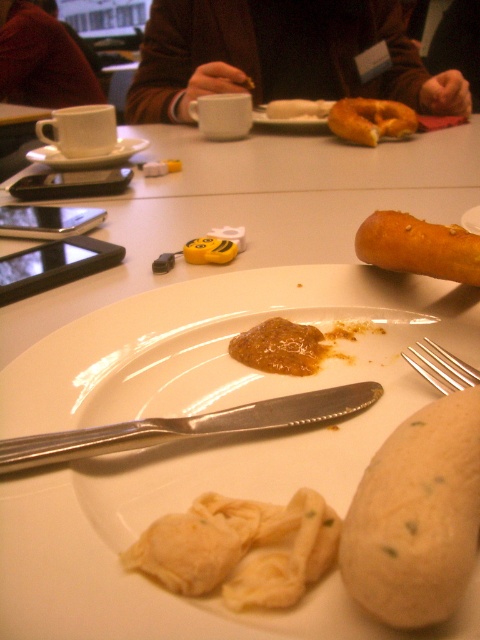
Question: Does smooth beige bread at lower right have a lesser width compared to soft yellow pasta at plate center?

Choices:
 (A) yes
 (B) no

Answer: (A)

Question: Does soft yellow pasta at plate center appear on the right side of brown glossy jam at center?

Choices:
 (A) no
 (B) yes

Answer: (A)

Question: Among these points, which one is nearest to the camera?

Choices:
 (A) (19, 19)
 (B) (280, 348)
 (C) (408, 595)
 (D) (333, 1)

Answer: (C)

Question: Which of the following is the farthest from the observer?

Choices:
 (A) smooth white bread at center
 (B) golden crispy bread at right
 (C) dark brown leather jacket at upper left
 (D) smooth beige bread at lower right

Answer: (C)

Question: Is smooth beige bread at lower right to the right of silver metallic knife at center from the viewer's perspective?

Choices:
 (A) no
 (B) yes

Answer: (B)

Question: Among these objects, which one is nearest to the camera?

Choices:
 (A) smooth beige bread at lower right
 (B) dark brown leather jacket at upper left
 (C) smooth white bread at center
 (D) golden crispy bread at right

Answer: (A)